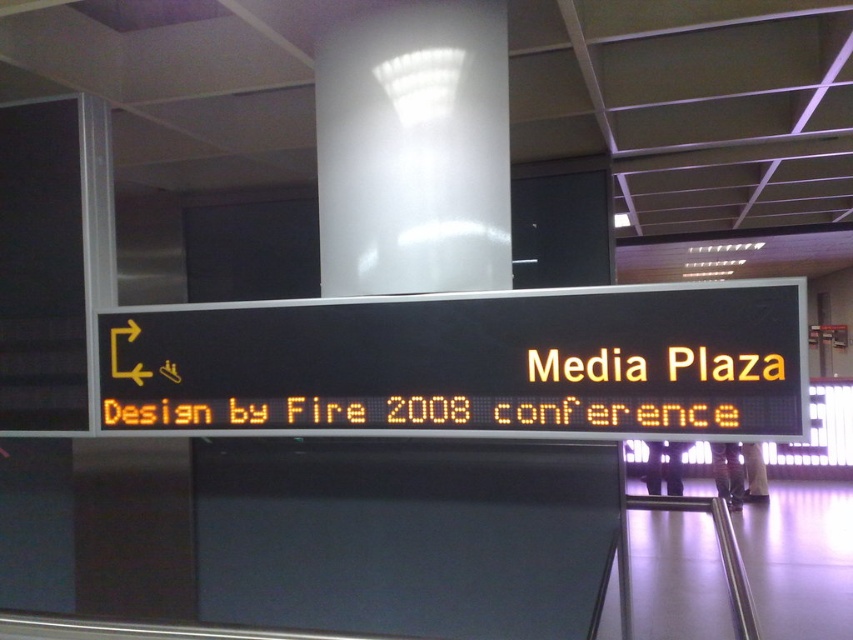
Who is more forward, (x=634, y=358) or (x=368, y=44)?

Point (x=634, y=358)

Looking at this image, is yellow led display at center above white glossy pillar at upper center?

→ No.

Is point (627, 372) farther from camera compared to point (358, 93)?

No, it is not.

You are a GUI agent. You are given a task and a screenshot of the screen. Output one action in this format:
    pyautogui.click(x=<x>, y=<y>)
    Task: Click on the yellow led display at center
    The image size is (853, 640).
    Given the screenshot: What is the action you would take?
    pyautogui.click(x=467, y=362)